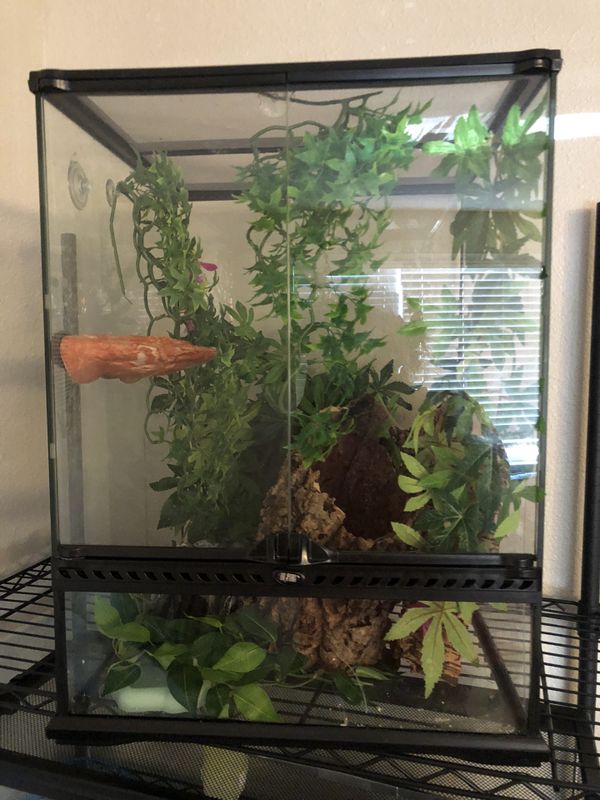
I want to click on reflection of white blinds on a window, so click(486, 352).